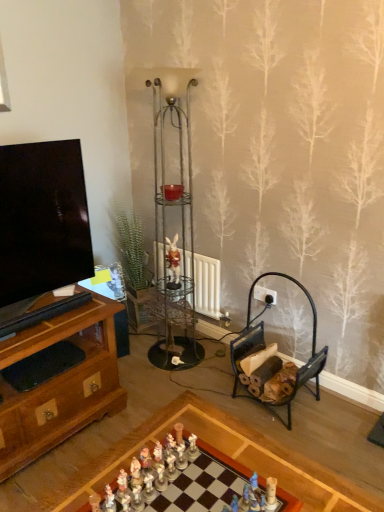
Locate an element on the screen. vacant space to the right of white porcelain figurines at center, the third toy viewed from the front is located at coordinates (227, 464).